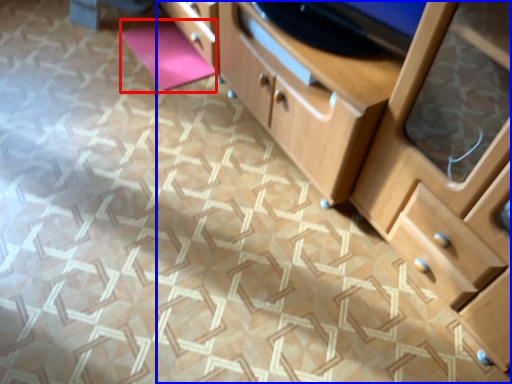
Question: Which of the following is the closest to the observer, yoga mat (highlighted by a red box) or chest of drawers (highlighted by a blue box)?

Choices:
 (A) yoga mat
 (B) chest of drawers

Answer: (B)